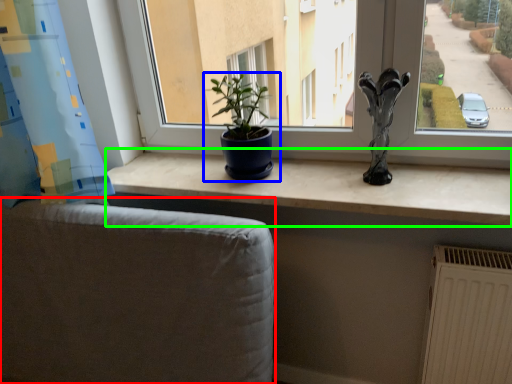
Question: Considering the real-world distances, which object is farthest from armchair (highlighted by a red box)? houseplant (highlighted by a blue box) or counter top (highlighted by a green box)?

Choices:
 (A) houseplant
 (B) counter top

Answer: (A)